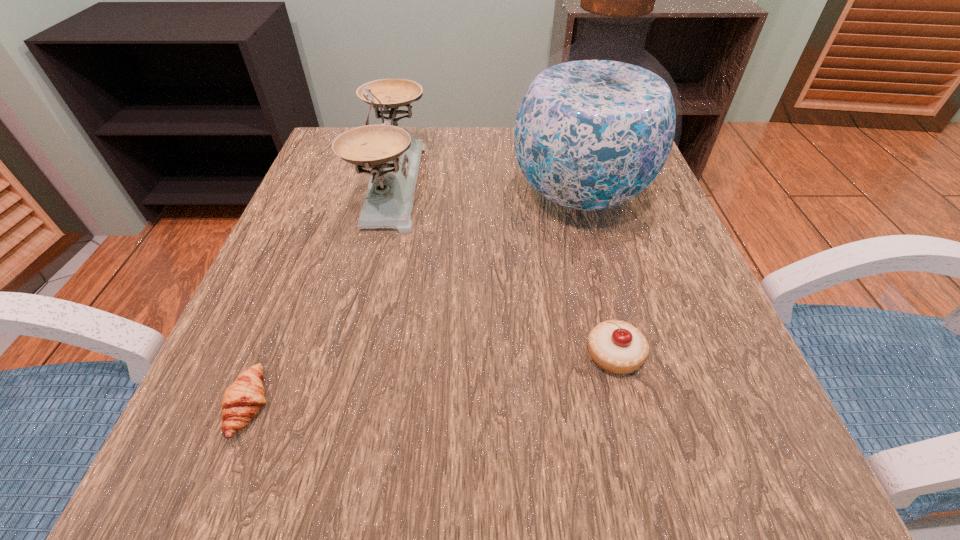
The width and height of the screenshot is (960, 540). In order to click on free space that satisfies the following two spatial constraints: 1. on the front-facing side of the third shortest object; 2. on the back side of the right pastry in this screenshot , I will do `click(352, 355)`.

Where is `free location that satisfies the following two spatial constraints: 1. on the front-facing side of the tallest object; 2. on the right side of the third object from right to left`? Image resolution: width=960 pixels, height=540 pixels. free location that satisfies the following two spatial constraints: 1. on the front-facing side of the tallest object; 2. on the right side of the third object from right to left is located at coordinates (391, 195).

Find the location of a particular element. vacant space that satisfies the following two spatial constraints: 1. on the front side of the right pastry; 2. on the front-facing side of the shortest object is located at coordinates click(627, 405).

You are a GUI agent. You are given a task and a screenshot of the screen. Output one action in this format:
    pyautogui.click(x=<x>, y=<y>)
    Task: Click on the vacant region that satisfies the following two spatial constraints: 1. on the front-facing side of the scale; 2. on the left side of the tallest object
    The image size is (960, 540).
    Given the screenshot: What is the action you would take?
    pyautogui.click(x=391, y=195)

What are the coordinates of `free point that satisfies the following two spatial constraints: 1. on the back side of the right pastry; 2. on the front-facing side of the scale` in the screenshot? It's located at (571, 184).

This screenshot has width=960, height=540. Find the location of `free region that satisfies the following two spatial constraints: 1. on the front-facing side of the scale; 2. on the right side of the taller pastry`. free region that satisfies the following two spatial constraints: 1. on the front-facing side of the scale; 2. on the right side of the taller pastry is located at coordinates (352, 355).

The image size is (960, 540). Find the location of `vacant area that satisfies the following two spatial constraints: 1. on the front-facing side of the taller pastry; 2. on the right side of the scale`. vacant area that satisfies the following two spatial constraints: 1. on the front-facing side of the taller pastry; 2. on the right side of the scale is located at coordinates (352, 355).